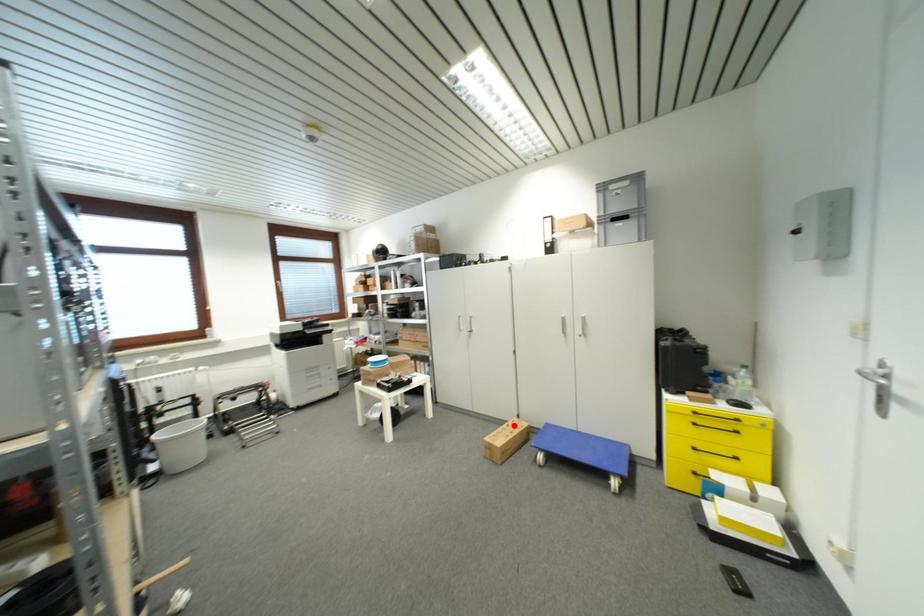
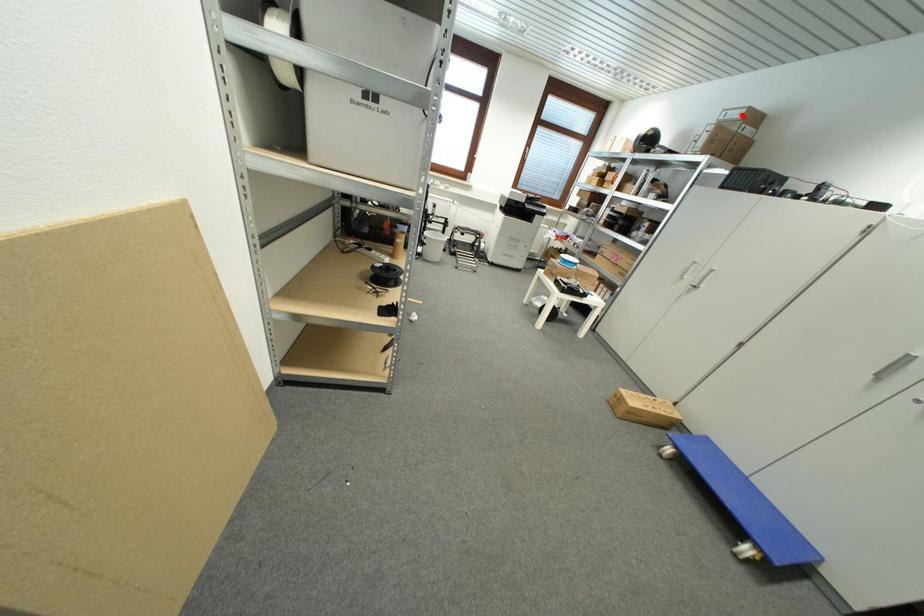
I am providing you with two images of the same scene from different viewpoints. A red point is marked on the first image and another point is marked on the second image. Are the points marked in image1 and image2 representing the same 3D position?

No